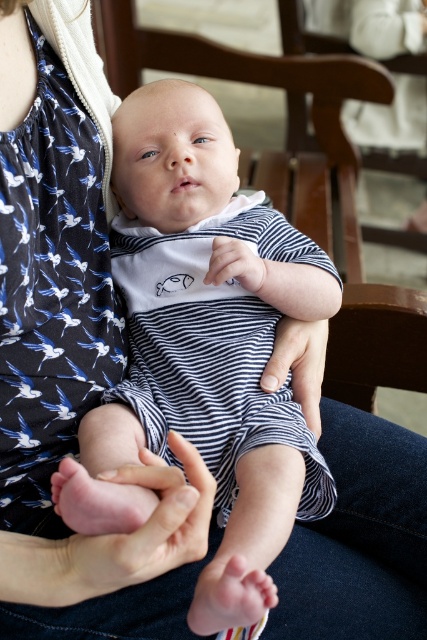
Question: Estimate the real-world distances between objects in this image. Which object is closer to the matte striped fabric at center?

Choices:
 (A) white soft fabric hand at center
 (B) pink flesh at center
 (C) striped cotton onesie at center

Answer: (A)

Question: Is striped cotton onesie at center smaller than white soft fabric hand at center?

Choices:
 (A) no
 (B) yes

Answer: (A)

Question: Does matte striped fabric at center have a smaller size compared to white soft fabric hand at center?

Choices:
 (A) yes
 (B) no

Answer: (B)

Question: Does matte striped fabric at center have a larger size compared to white soft fabric hand at center?

Choices:
 (A) no
 (B) yes

Answer: (B)

Question: Among these points, which one is nearest to the camera?

Choices:
 (A) (155, 566)
 (B) (257, 257)
 (C) (321, 349)

Answer: (A)

Question: Which point is closer to the camera?

Choices:
 (A) (84, 561)
 (B) (228, 266)

Answer: (A)